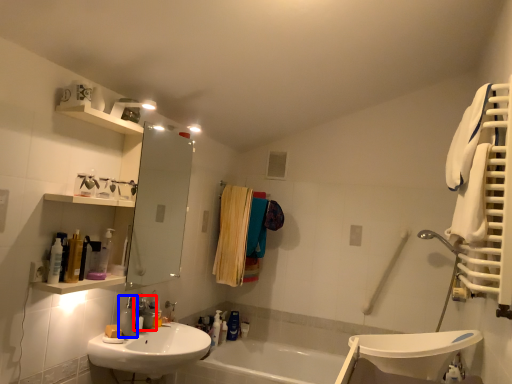
Question: Among these objects, which one is farthest to the camera, plumbing fixture (highlighted by a red box) or soap dispenser (highlighted by a blue box)?

Choices:
 (A) plumbing fixture
 (B) soap dispenser

Answer: (A)